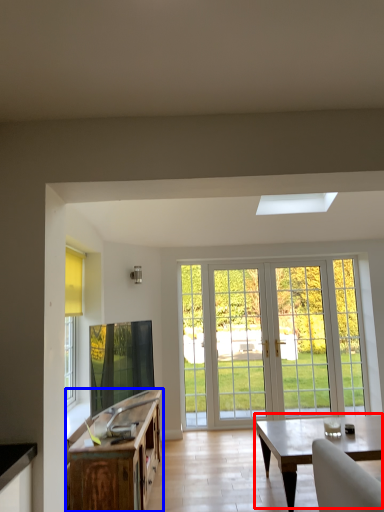
Question: Which object appears farthest to the camera in this image, coffee table (highlighted by a red box) or cabinetry (highlighted by a blue box)?

Choices:
 (A) coffee table
 (B) cabinetry

Answer: (A)